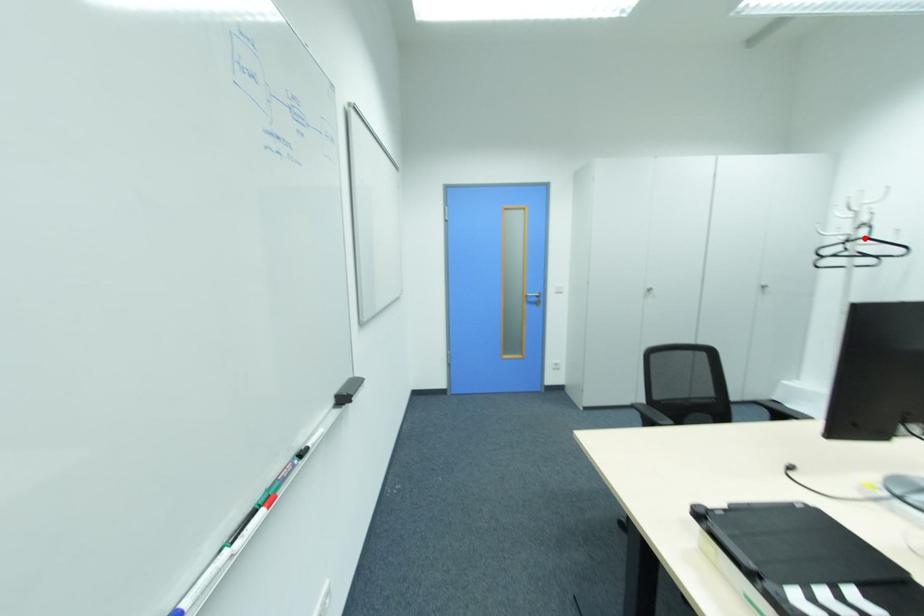
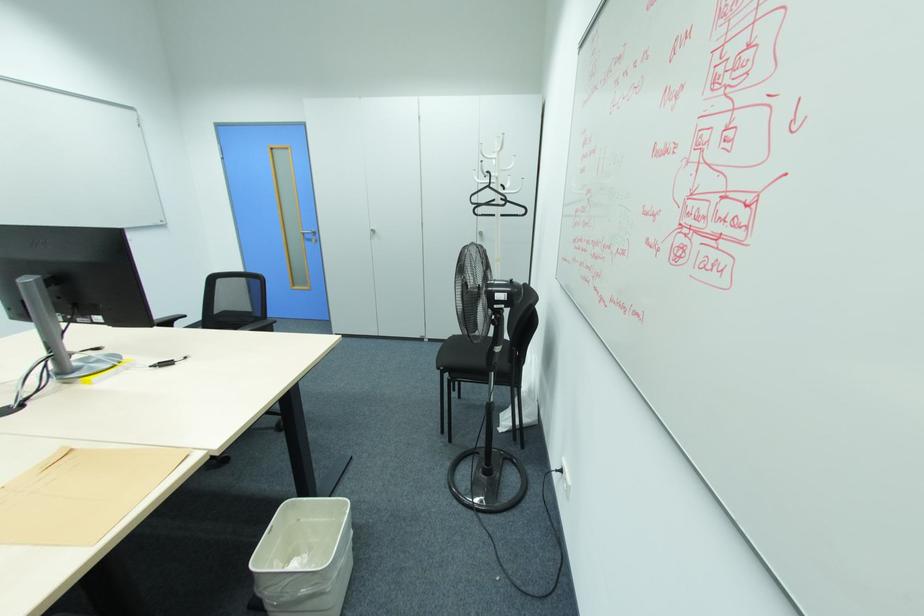
Question: I am providing you with two images of the same scene from different viewpoints. In image1, a red point is highlighted. Considering the same 3D point in image2, which of the following is correct?

Choices:
 (A) It is closer
 (B) It is farther

Answer: (A)